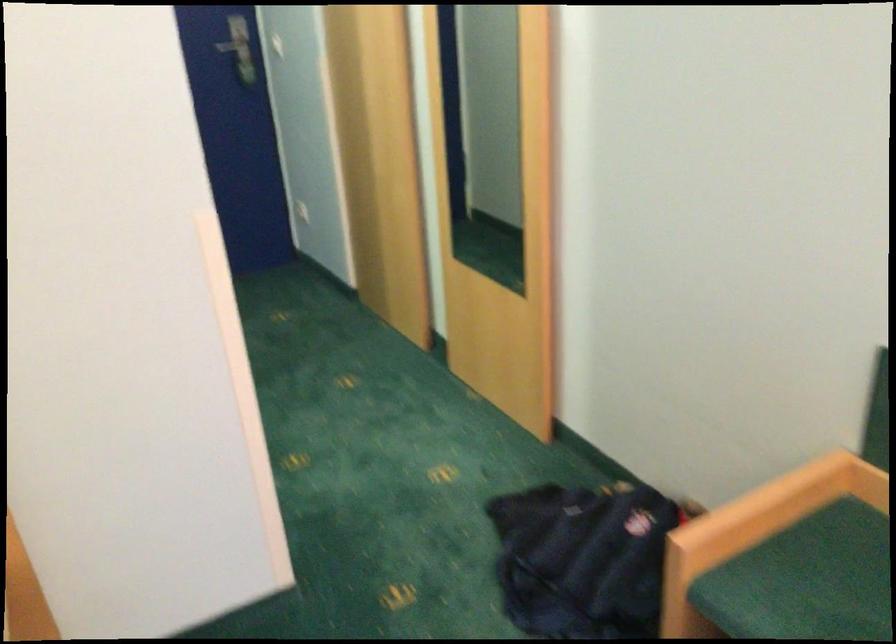
At what (x,y) coordinates should I click in order to perform the action: click on wooden chair armrest. Please return your answer as a coordinate pair (x, y). The width and height of the screenshot is (896, 644). Looking at the image, I should click on (756, 529).